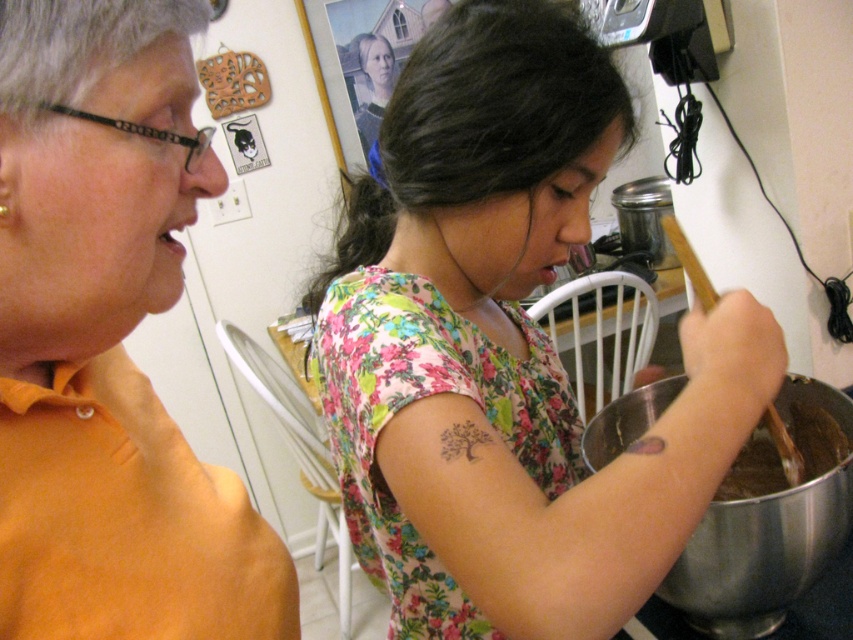
Consider the image. You are a kitchen assistant and need to pass the metallic silver mixing bowl at lower right to the person wearing the floral fabric shirt at center. Can you hand it directly without moving either of them?

The floral fabric shirt at center is 8.05 inches away from the metallic silver mixing bowl at lower right, so yes, you can hand it directly without needing to move either of them since the distance is manageable for passing.

You are standing in the kitchen and need to reach a spice jar located at point (569,420). There is an obstacle at point (674,588). Can you navigate around the obstacle to reach the spice jar?

Point (569,420) is behind point (674,588), so you can navigate around the obstacle at point (674,588) to reach the spice jar at point (569,420).